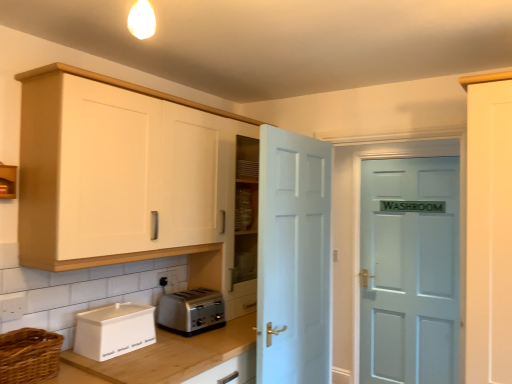
This screenshot has width=512, height=384. Describe the element at coordinates (114, 330) in the screenshot. I see `white matte bread bin at lower left` at that location.

Locate an element on the screen. white matte bread bin at lower left is located at coordinates (114, 330).

This screenshot has width=512, height=384. What do you see at coordinates (8, 181) in the screenshot?
I see `matte wood cabinet at upper left, placed as the 1th cabinetry when sorted from left to right` at bounding box center [8, 181].

What is the approximate height of matte wood cabinet at upper left, placed as the 1th cabinetry when sorted from left to right?

It is 6.53 inches.

In order to face white plastic electric outlet at lower center, should I rotate leftwards or rightwards?

You should rotate left by 11.854 degrees.

What do you see at coordinates (29, 355) in the screenshot? The width and height of the screenshot is (512, 384). I see `woven brown basket at lower left` at bounding box center [29, 355].

Describe the element at coordinates (121, 172) in the screenshot. This screenshot has width=512, height=384. I see `white matte cabinet at upper left, which is the second cabinetry in left-to-right order` at that location.

Identify the location of satin silver toaster at lower center. (191, 311).

This screenshot has height=384, width=512. What do you see at coordinates (409, 270) in the screenshot?
I see `white wooden door at right, the 1th door from the back` at bounding box center [409, 270].

Locate an element on the screen. The width and height of the screenshot is (512, 384). white matte bread bin at lower left is located at coordinates (114, 330).

Is woven brown basket at lower left further to camera compared to white wooden door at right, which is the first door in right-to-left order?

No, woven brown basket at lower left is closer to the camera.

In the scene shown: From the image's perspective, which is below, woven brown basket at lower left or white wooden door at right, the 1th door from the back?

white wooden door at right, the 1th door from the back, appears lower in the image.

Find the location of `door that is the 2nd object located behind the woven brown basket at lower left`. door that is the 2nd object located behind the woven brown basket at lower left is located at coordinates (409, 270).

In order to click on electric outlet located above the wooden at lower left (from a real-world perspective) in this screenshot , I will do `click(167, 278)`.

What's the angular difference between white plastic electric outlet at lower center and wooden at lower left's facing directions?

0.952 degrees.

Which object is positioned more to the left, white plastic electric outlet at lower center or wooden at lower left?

white plastic electric outlet at lower center.

Is white plastic electric outlet at lower center beside wooden at lower left?

They are not placed beside each other.

From the image's perspective, is satin silver toaster at lower center beneath white wooden door at right, the 1th door from the back?

No.

Considering the sizes of objects satin silver toaster at lower center and white wooden door at right, which is the first door in right-to-left order, in the image provided, who is thinner, satin silver toaster at lower center or white wooden door at right, which is the first door in right-to-left order,?

white wooden door at right, which is the first door in right-to-left order, is thinner.

From a real-world perspective, who is located higher, satin silver toaster at lower center or white wooden door at right, the 1th door from the back?

white wooden door at right, the 1th door from the back.

What are the coordinates of `toaster located underneath the white wooden door at right, which is the first door in right-to-left order (from a real-world perspective)` in the screenshot? It's located at (191, 311).

Considering the points (13, 352) and (152, 372), which point is in front, point (13, 352) or point (152, 372)?

The point (13, 352) is more forward.

Is woven brown basket at lower left to the left or to the right of wooden at lower left in the image?

woven brown basket at lower left is positioned on wooden at lower left's left side.

Can you tell me how much woven brown basket at lower left and wooden at lower left differ in facing direction?

0.587 degrees.

Where is `basket that is above the wooden at lower left (from the image's perspective)`? basket that is above the wooden at lower left (from the image's perspective) is located at coordinates (29, 355).

Would you say white matte bread bin at lower left is a long distance from white painted wood door at center, marked as the 1th door in a front-to-back arrangement?

They are positioned close to each other.

Is white matte bread bin at lower left turned away from white painted wood door at center, which is the first door from left to right?

That's not correct — white matte bread bin at lower left is not looking away from white painted wood door at center, which is the first door from left to right.

Between white matte bread bin at lower left and white painted wood door at center, marked as the 1th door in a front-to-back arrangement, which one is positioned in front?

white matte bread bin at lower left is in front.

In the scene shown: From a real-world perspective, which object rests below the other?

white matte bread bin at lower left, from a real-world perspective.

Between matte wood cabinet at upper left, placed as the 1th cabinetry when sorted from left to right, and white wooden door at right, the 2th door when ordered from front to back, which one is positioned behind?

Positioned behind is white wooden door at right, the 2th door when ordered from front to back.

From a real-world perspective, is matte wood cabinet at upper left, placed as the 1th cabinetry when sorted from left to right, positioned over white wooden door at right, which is the first door in right-to-left order, based on gravity?

Yes, from a real-world perspective, matte wood cabinet at upper left, placed as the 1th cabinetry when sorted from left to right, is on top of white wooden door at right, which is the first door in right-to-left order.

Is point (2, 192) more distant than point (398, 266)?

No, it is not.

Between matte wood cabinet at upper left, placed as the 1th cabinetry when sorted from left to right, and white wooden door at right, the 1th door from the back, which one appears on the right side from the viewer's perspective?

white wooden door at right, the 1th door from the back.

Considering the sizes of objects white matte cabinet at upper left, which is the second cabinetry in left-to-right order, and wooden at lower left in the image provided, who is taller, white matte cabinet at upper left, which is the second cabinetry in left-to-right order, or wooden at lower left?

white matte cabinet at upper left, which is the second cabinetry in left-to-right order, is taller.

Is white matte cabinet at upper left, positioned as the 1th cabinetry in right-to-left order, not within wooden at lower left?

white matte cabinet at upper left, positioned as the 1th cabinetry in right-to-left order, is positioned outside wooden at lower left.

Considering the relative sizes of white matte cabinet at upper left, which is the second cabinetry in left-to-right order, and wooden at lower left in the image provided, is white matte cabinet at upper left, which is the second cabinetry in left-to-right order, thinner than wooden at lower left?

Correct, the width of white matte cabinet at upper left, which is the second cabinetry in left-to-right order, is less than that of wooden at lower left.

Identify the location of the 2nd door behind the woven brown basket at lower left. (409, 270).

The image size is (512, 384). Find the location of `countertop located underneath the white plastic electric outlet at lower center (from a real-world perspective)`. countertop located underneath the white plastic electric outlet at lower center (from a real-world perspective) is located at coordinates (170, 355).

Considering their positions, is white matte bread bin at lower left positioned further to white matte cabinet at upper left, which is the second cabinetry in left-to-right order, than white plastic electric outlet at lower center?

white plastic electric outlet at lower center is further to white matte cabinet at upper left, which is the second cabinetry in left-to-right order.

From the image, which object appears to be nearer to white matte cabinet at upper left, positioned as the 1th cabinetry in right-to-left order, white wooden door at right, which is the first door in right-to-left order, or matte wood cabinet at upper left, placed as the 1th cabinetry when sorted from left to right?

matte wood cabinet at upper left, placed as the 1th cabinetry when sorted from left to right.

From the image, which object appears to be nearer to wooden at lower left, white plastic electric outlet at lower center or white matte cabinet at upper left, which is the second cabinetry in left-to-right order?

white plastic electric outlet at lower center lies closer to wooden at lower left than the other object.

Estimate the real-world distances between objects in this image. Which object is further from satin silver toaster at lower center, matte wood cabinet at upper left, which is counted as the 2th cabinetry, starting from the right, or white matte bread bin at lower left?

The object further to satin silver toaster at lower center is matte wood cabinet at upper left, which is counted as the 2th cabinetry, starting from the right.

Estimate the real-world distances between objects in this image. Which object is closer to white painted wood door at center, the 2th door when ordered from right to left, satin silver toaster at lower center or white matte bread bin at lower left?

satin silver toaster at lower center is positioned closer to the anchor white painted wood door at center, the 2th door when ordered from right to left.

Estimate the real-world distances between objects in this image. Which object is further from white matte bread bin at lower left, satin silver toaster at lower center or white plastic electric outlet at lower center?

white plastic electric outlet at lower center.

Which object lies nearer to the anchor point white matte cabinet at upper left, which is the second cabinetry in left-to-right order, white wooden door at right, the 1th door from the back, or white painted wood door at center, marked as the 1th door in a front-to-back arrangement?

Based on the image, white painted wood door at center, marked as the 1th door in a front-to-back arrangement, appears to be nearer to white matte cabinet at upper left, which is the second cabinetry in left-to-right order.

When comparing their distances from white plastic electric outlet at lower center, does matte wood cabinet at upper left, placed as the 1th cabinetry when sorted from left to right, or white painted wood door at center, which is the first door from left to right, seem further?

Based on the image, matte wood cabinet at upper left, placed as the 1th cabinetry when sorted from left to right, appears to be further to white plastic electric outlet at lower center.

Identify the location of toaster positioned between wooden at lower left and white wooden door at right, the 1th door from the back, from near to far. The image size is (512, 384). (191, 311).

At what (x,y) coordinates should I click in order to perform the action: click on countertop situated between woven brown basket at lower left and white painted wood door at center, which is the second door in back-to-front order, from left to right. Please return your answer as a coordinate pair (x, y). Image resolution: width=512 pixels, height=384 pixels. Looking at the image, I should click on (170, 355).

At what (x,y) coordinates should I click in order to perform the action: click on basket between white matte cabinet at upper left, which is the second cabinetry in left-to-right order, and wooden at lower left from top to bottom. Please return your answer as a coordinate pair (x, y). Image resolution: width=512 pixels, height=384 pixels. Looking at the image, I should click on (29, 355).

The width and height of the screenshot is (512, 384). Find the location of `toaster between matte wood cabinet at upper left, placed as the 1th cabinetry when sorted from left to right, and wooden at lower left vertically`. toaster between matte wood cabinet at upper left, placed as the 1th cabinetry when sorted from left to right, and wooden at lower left vertically is located at coordinates (191, 311).